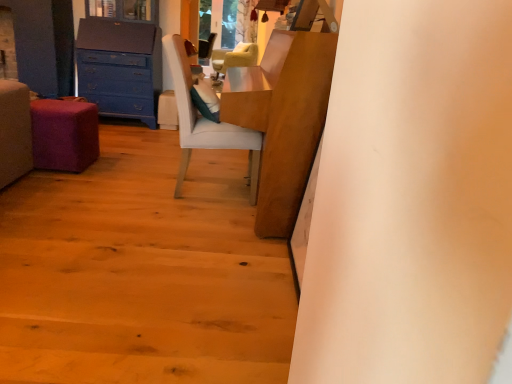
This screenshot has height=384, width=512. What do you see at coordinates (234, 58) in the screenshot?
I see `velvet beige armchair at center, the 2th chair viewed from the front` at bounding box center [234, 58].

Identify the location of blue painted wood chest of drawers at left. (120, 67).

In order to face purple fabric stool at lower left, should I rotate leftwards or rightwards?

Turn left by 24.782 degrees to look at purple fabric stool at lower left.

What is the approximate width of white fabric chair at center, the first chair in the front-to-back sequence?

It is 24.76 inches.

Image resolution: width=512 pixels, height=384 pixels. Identify the location of wooden floor at lower left. (141, 272).

Find the location of a particular element. velvet beige armchair at center, the 2th chair viewed from the front is located at coordinates (234, 58).

Which object is further away from the camera taking this photo, white fabric chair at center, arranged as the 2th chair when viewed from the back, or wooden table at center?

white fabric chair at center, arranged as the 2th chair when viewed from the back, is behind.

Is white fabric chair at center, which is the 1th chair from bottom to top, next to wooden table at center and touching it?

No, white fabric chair at center, which is the 1th chair from bottom to top, is not beside wooden table at center.

How many degrees apart are the facing directions of white fabric chair at center, which is the 1th chair from bottom to top, and wooden table at center?

The angle between the facing direction of white fabric chair at center, which is the 1th chair from bottom to top, and the facing direction of wooden table at center is 177 degrees.

Is point (201, 121) positioned before point (265, 52)?

Yes.

Can you confirm if white fabric chair at center, which is the 1th chair from bottom to top, is smaller than blue painted wood chest of drawers at left?

Indeed, white fabric chair at center, which is the 1th chair from bottom to top, has a smaller size compared to blue painted wood chest of drawers at left.

Are white fabric chair at center, which is the 1th chair from bottom to top, and blue painted wood chest of drawers at left making contact?

No, white fabric chair at center, which is the 1th chair from bottom to top, is not with blue painted wood chest of drawers at left.

Between point (193, 115) and point (129, 50), which one is positioned in front?

Point (193, 115)

Which is more to the left, white fabric chair at center, the first chair in the front-to-back sequence, or velvet beige armchair at center, the 2th chair viewed from the front?

velvet beige armchair at center, the 2th chair viewed from the front.

Consider the image. Measure the distance between white fabric chair at center, the first chair in the front-to-back sequence, and velvet beige armchair at center, the 2th chair viewed from the front.

white fabric chair at center, the first chair in the front-to-back sequence, and velvet beige armchair at center, the 2th chair viewed from the front, are 22.23 inches apart.

In the image, is white fabric chair at center, arranged as the 2th chair when viewed from the back, positioned in front of or behind velvet beige armchair at center, the 2th chair viewed from the front?

Visually, white fabric chair at center, arranged as the 2th chair when viewed from the back, is located in front of velvet beige armchair at center, the 2th chair viewed from the front.

This screenshot has width=512, height=384. In order to click on chair that appears on the left of white fabric chair at center, which is the 1th chair from bottom to top in this screenshot , I will do `click(234, 58)`.

Is purple fabric stool at lower left turned away from wooden floor at lower left?

Yes, wooden floor at lower left is at the back of purple fabric stool at lower left.

What are the coordinates of `stool lying above the wooden floor at lower left (from the image's perspective)` in the screenshot? It's located at (64, 134).

Does purple fabric stool at lower left have a greater height compared to wooden floor at lower left?

Yes, purple fabric stool at lower left is taller than wooden floor at lower left.

Find the location of a particular element. The width and height of the screenshot is (512, 384). table above the velvet beige armchair at center, the 1th chair viewed from the top (from a real-world perspective) is located at coordinates (283, 119).

What's the angular difference between wooden table at center and velvet beige armchair at center, the 1th chair viewed from the top,'s facing directions?

28.8 degrees.

Choose the correct answer: Is wooden table at center inside velvet beige armchair at center, the 2th chair viewed from the front, or outside it?

wooden table at center is located beyond the bounds of velvet beige armchair at center, the 2th chair viewed from the front.

Which is in front, wooden floor at lower left or white fabric chair at center, which ranks as the 2th chair in top-to-bottom order?

Positioned in front is wooden floor at lower left.

Considering the sizes of objects wooden floor at lower left and white fabric chair at center, which ranks as the 2th chair in top-to-bottom order, in the image provided, who is smaller, wooden floor at lower left or white fabric chair at center, which ranks as the 2th chair in top-to-bottom order,?

white fabric chair at center, which ranks as the 2th chair in top-to-bottom order, is smaller.

Where is `the 2nd chair to the right when counting from the wooden floor at lower left`? This screenshot has height=384, width=512. the 2nd chair to the right when counting from the wooden floor at lower left is located at coordinates coord(205,122).

Is wooden floor at lower left not inside white fabric chair at center, arranged as the 2th chair when viewed from the back?

wooden floor at lower left is positioned outside white fabric chair at center, arranged as the 2th chair when viewed from the back.

Is white fabric chair at center, the first chair in the front-to-back sequence, not close to wooden floor at lower left?

They are positioned close to each other.

From the image's perspective, is white fabric chair at center, which ranks as the 2th chair in top-to-bottom order, beneath wooden floor at lower left?

Actually, white fabric chair at center, which ranks as the 2th chair in top-to-bottom order, appears above wooden floor at lower left in the image.

Considering the sizes of white fabric chair at center, which is the 1th chair from bottom to top, and wooden floor at lower left in the image, is white fabric chair at center, which is the 1th chair from bottom to top, wider or thinner than wooden floor at lower left?

Clearly, white fabric chair at center, which is the 1th chair from bottom to top, has less width compared to wooden floor at lower left.

Can you confirm if white fabric chair at center, which is the 1th chair from bottom to top, is bigger than wooden floor at lower left?

No.

From a real-world perspective, count 1st chairs downward from the wooden table at center and point to it. Please provide its 2D coordinates.

[(205, 122)]

Identify the location of chest of drawers that is on the left side of white fabric chair at center, arranged as the 2th chair when viewed from the back. Image resolution: width=512 pixels, height=384 pixels. (120, 67).

Which object lies nearer to the anchor point white fabric chair at center, which is the 1th chair from bottom to top, purple fabric stool at lower left or velvet beige armchair at center, the 2th chair viewed from the front?

The object closer to white fabric chair at center, which is the 1th chair from bottom to top, is velvet beige armchair at center, the 2th chair viewed from the front.

When comparing their distances from velvet beige armchair at center, the 2th chair viewed from the front, does wooden table at center or purple fabric stool at lower left seem further?

purple fabric stool at lower left is further to velvet beige armchair at center, the 2th chair viewed from the front.

Considering their positions, is velvet beige armchair at center, which is the second chair from bottom to top, positioned closer to blue painted wood chest of drawers at left than purple fabric stool at lower left?

Based on the image, velvet beige armchair at center, which is the second chair from bottom to top, appears to be nearer to blue painted wood chest of drawers at left.

In the scene shown: Looking at the image, which one is located further to wooden floor at lower left, purple fabric stool at lower left or wooden table at center?

Based on the image, wooden table at center appears to be further to wooden floor at lower left.

Based on their spatial positions, is velvet beige armchair at center, the 1th chair viewed from the back, or blue painted wood chest of drawers at left closer to purple fabric stool at lower left?

velvet beige armchair at center, the 1th chair viewed from the back, lies closer to purple fabric stool at lower left than the other object.

Considering their positions, is velvet beige armchair at center, the 2th chair viewed from the front, positioned further to wooden table at center than purple fabric stool at lower left?

purple fabric stool at lower left is positioned further to the anchor wooden table at center.

From the picture: Looking at the image, which one is located further to purple fabric stool at lower left, wooden floor at lower left or wooden table at center?

wooden table at center.

From the image, which object appears to be nearer to white fabric chair at center, which ranks as the 2th chair in top-to-bottom order, blue painted wood chest of drawers at left or wooden floor at lower left?

wooden floor at lower left lies closer to white fabric chair at center, which ranks as the 2th chair in top-to-bottom order, than the other object.

Locate an element on the screen. The width and height of the screenshot is (512, 384). table positioned between wooden floor at lower left and white fabric chair at center, which is the 1th chair from bottom to top, from near to far is located at coordinates click(x=283, y=119).

Identify the location of stool between white fabric chair at center, which ranks as the 2th chair in top-to-bottom order, and blue painted wood chest of drawers at left from front to back. (64, 134).

This screenshot has height=384, width=512. I want to click on chest of drawers between purple fabric stool at lower left and velvet beige armchair at center, which is the second chair from bottom to top, in the front-back direction, so click(120, 67).

Where is `stool between wooden table at center and velvet beige armchair at center, which is the second chair from bottom to top, in the front-back direction`? The image size is (512, 384). stool between wooden table at center and velvet beige armchair at center, which is the second chair from bottom to top, in the front-back direction is located at coordinates (64, 134).